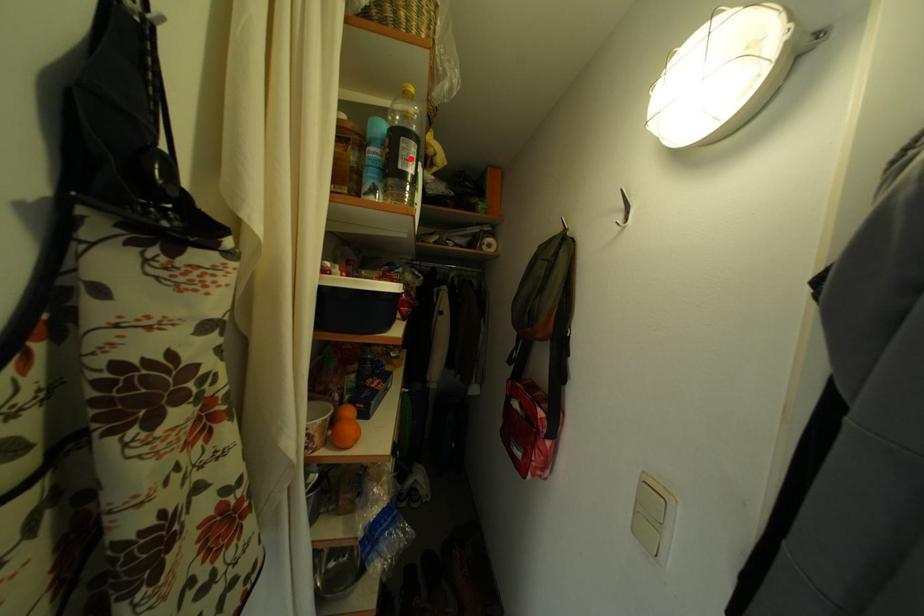
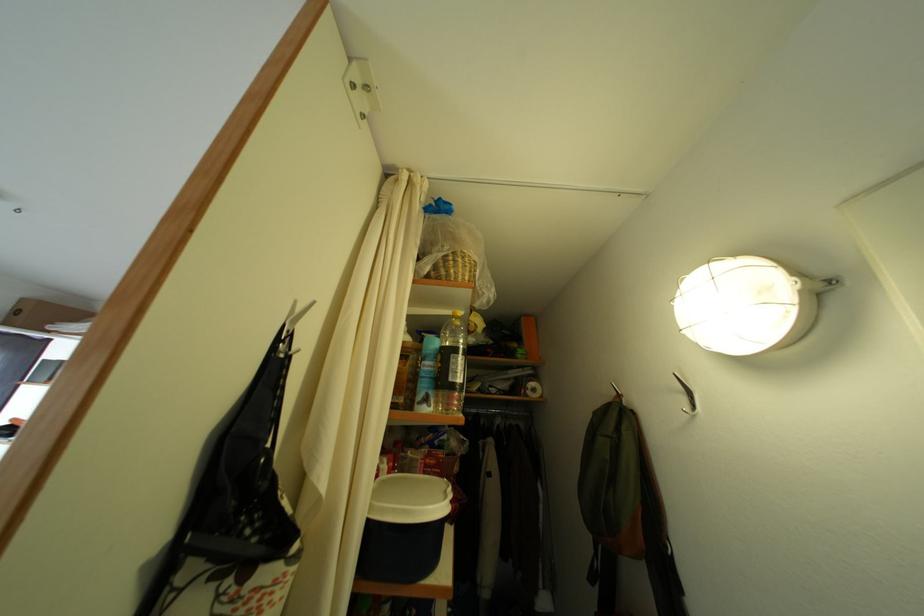
Locate, in the second image, the point that corresponds to the highlighted location in the first image.

(460, 373)